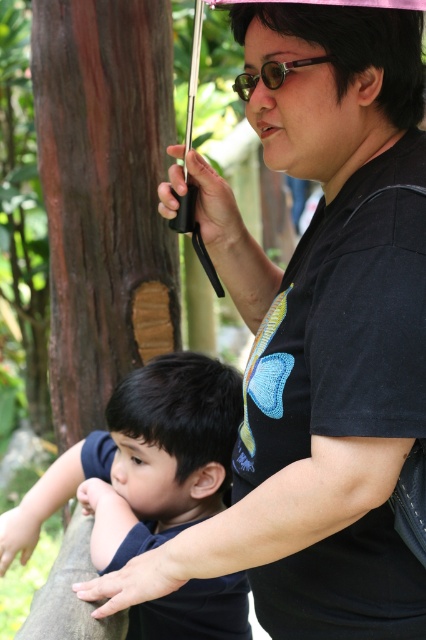
Between pink matte umbrella at upper center and gold reflective lenses at center, which one is positioned higher?

gold reflective lenses at center

Describe the element at coordinates (336, 44) in the screenshot. Image resolution: width=426 pixels, height=640 pixels. I see `pink matte umbrella at upper center` at that location.

Where is `pink matte umbrella at upper center`? Image resolution: width=426 pixels, height=640 pixels. pink matte umbrella at upper center is located at coordinates (336, 44).

Can you confirm if dark blue shirt at lower left is smaller than pink matte umbrella at upper center?

Incorrect, dark blue shirt at lower left is not smaller in size than pink matte umbrella at upper center.

In the scene shown: Which of these two, dark blue shirt at lower left or pink matte umbrella at upper center, stands shorter?

pink matte umbrella at upper center is shorter.

Is point (6, 518) closer to viewer compared to point (348, 29)?

No, (6, 518) is further to viewer.

Locate an element on the screen. This screenshot has width=426, height=640. dark blue shirt at lower left is located at coordinates (143, 461).

Between dark blue shirt at lower left and gold reflective lenses at center, which one has less height?

gold reflective lenses at center

Can you confirm if dark blue shirt at lower left is shorter than gold reflective lenses at center?

In fact, dark blue shirt at lower left may be taller than gold reflective lenses at center.

At what (x,y) coordinates should I click in order to perform the action: click on dark blue shirt at lower left. Please return your answer as a coordinate pair (x, y). The height and width of the screenshot is (640, 426). Looking at the image, I should click on (143, 461).